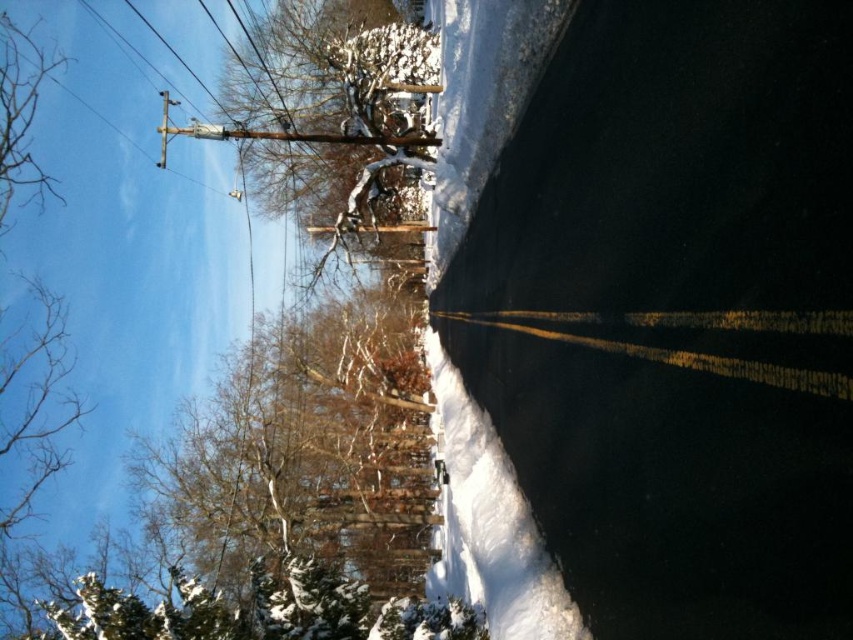
You are standing at the center of the road looking towards the brown textured tree at left. Based on the coordinates provided, in which direction should you walk to reach the tree?

The brown textured tree at left is located at coordinates (311, 448). Since you are at the center of the road, you should walk towards the left side of the road to reach the tree.

You are standing at the camera position and want to take a photo of the brown textured tree at left. If your camera has a maximum focus range of 100 feet, will you be able to capture the tree in focus?

The brown textured tree at left and camera are 91.50 feet apart from each other. Since the distance is within the camera maximum focus range of 100 feet, the camera can focus on the tree.